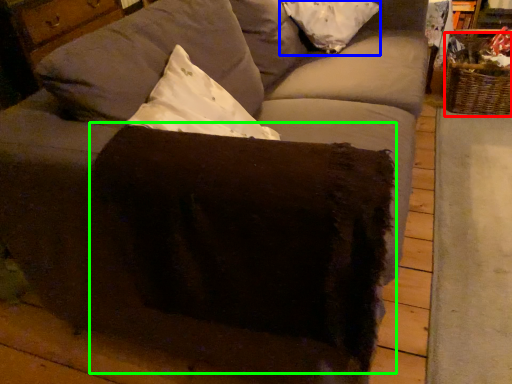
Question: Based on their relative distances, which object is farther from basket (highlighted by a red box)? Choose from pillow (highlighted by a blue box) and swivel chair (highlighted by a green box).

Choices:
 (A) pillow
 (B) swivel chair

Answer: (B)